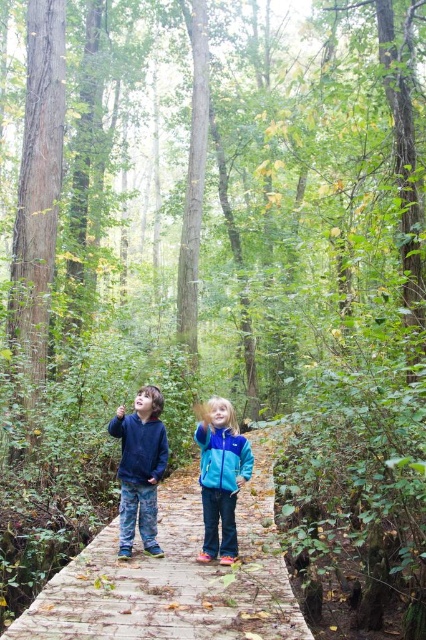
Locate an element on the screen. teal fleece jacket at center is located at coordinates (221, 477).

I want to click on teal fleece jacket at center, so click(221, 477).

Is denim pants at center to the right of blue fleece jacket at center from the viewer's perspective?

In fact, denim pants at center is to the left of blue fleece jacket at center.

Is denim pants at center above blue fleece jacket at center?

No, denim pants at center is not above blue fleece jacket at center.

Who is more forward, (157, 435) or (232, 458)?

Positioned in front is point (232, 458).

Image resolution: width=426 pixels, height=640 pixels. I want to click on denim pants at center, so click(x=140, y=468).

Does denim pants at center appear on the left side of matte blue jacket at center?

Incorrect, denim pants at center is not on the left side of matte blue jacket at center.

Is point (146, 476) in front of point (137, 422)?

Yes.

The height and width of the screenshot is (640, 426). What do you see at coordinates (140, 468) in the screenshot? I see `denim pants at center` at bounding box center [140, 468].

Identify the location of denim pants at center. (140, 468).